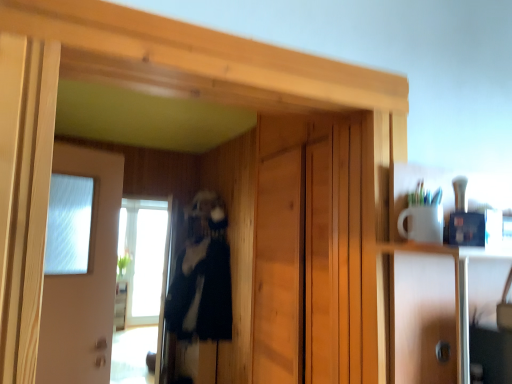
Question: Is the depth of transparent glass window at center less than that of white glossy door at left?

Choices:
 (A) no
 (B) yes

Answer: (A)

Question: From the image's perspective, is transparent glass window at center on top of white glossy door at left?

Choices:
 (A) no
 (B) yes

Answer: (A)

Question: Is white glossy door at left at the back of transparent glass window at center?

Choices:
 (A) yes
 (B) no

Answer: (B)

Question: Is white glossy door at left located within transparent glass window at center?

Choices:
 (A) yes
 (B) no

Answer: (B)

Question: From a real-world perspective, is transparent glass window at center positioned under white glossy door at left based on gravity?

Choices:
 (A) no
 (B) yes

Answer: (B)

Question: Is transparent glass window at center at the left side of white glossy door at left?

Choices:
 (A) yes
 (B) no

Answer: (A)

Question: Is black fuzzy coat at center in contact with transparent glass screen door at left?

Choices:
 (A) no
 (B) yes

Answer: (A)

Question: Can transparent glass screen door at left be found inside black fuzzy coat at center?

Choices:
 (A) no
 (B) yes

Answer: (A)

Question: From the image's perspective, is black fuzzy coat at center under transparent glass screen door at left?

Choices:
 (A) no
 (B) yes

Answer: (A)

Question: Would you say black fuzzy coat at center is outside transparent glass screen door at left?

Choices:
 (A) no
 (B) yes

Answer: (B)

Question: Is black fuzzy coat at center taller than transparent glass screen door at left?

Choices:
 (A) no
 (B) yes

Answer: (A)

Question: Is black fuzzy coat at center to the left of transparent glass screen door at left from the viewer's perspective?

Choices:
 (A) no
 (B) yes

Answer: (A)

Question: From the image's perspective, is transparent glass screen door at left below white glossy door at left?

Choices:
 (A) no
 (B) yes

Answer: (B)